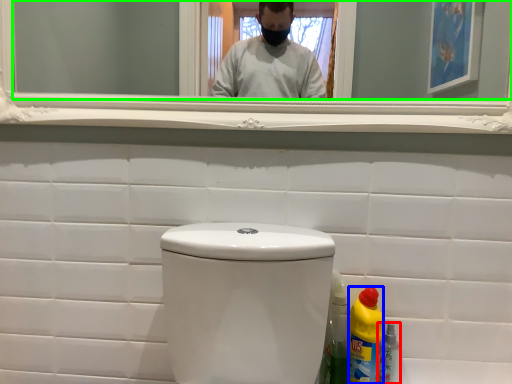
Question: Considering the real-world distances, which object is closest to bottle (highlighted by a red box)? bottle (highlighted by a blue box) or mirror (highlighted by a green box).

Choices:
 (A) bottle
 (B) mirror

Answer: (A)